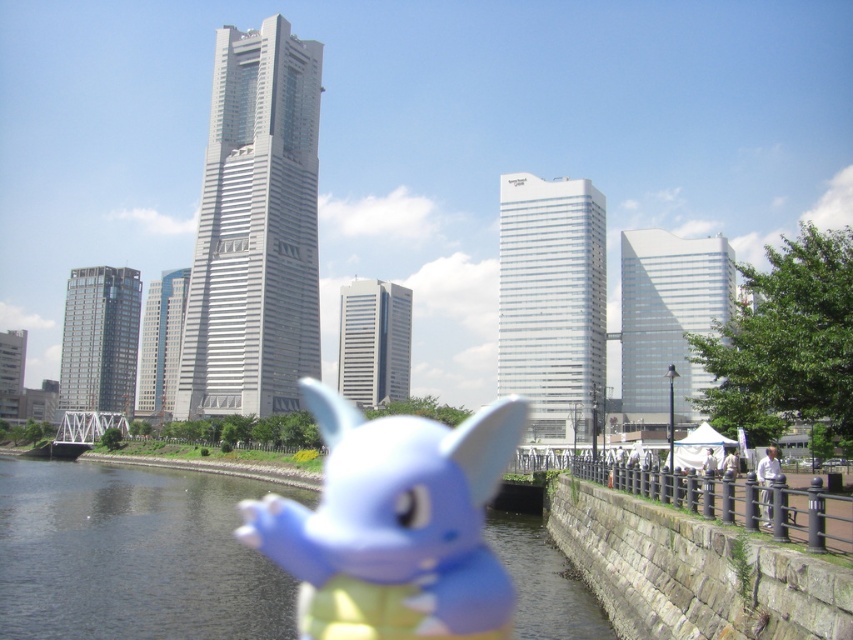
Measure the distance from smooth dark water at center to matte blue plush toy at center.

They are 11.96 meters apart.

Which is below, smooth dark water at center or matte blue plush toy at center?

smooth dark water at center

Describe the element at coordinates (132, 556) in the screenshot. I see `smooth dark water at center` at that location.

Image resolution: width=853 pixels, height=640 pixels. What are the coordinates of `smooth dark water at center` in the screenshot? It's located at (132, 556).